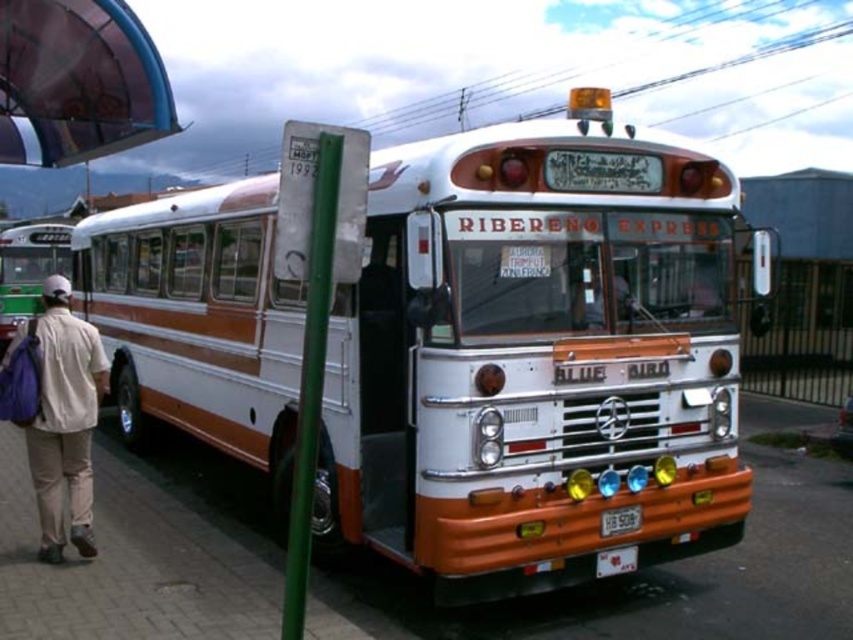
You are a delivery person trying to attach a package to the bus. The package requires a surface that can hold heavy items. Which object between the green metallic pole at center and the white plastic license plate at center would be more suitable for attaching the package?

The green metallic pole at center is larger in size than the white plastic license plate at center, so it would provide a more stable and secure surface for attaching the heavy package.

You are standing at the bus stop and want to take a photo of the vintage bus. The camera you have can only focus on objects within 15 feet. Is the point at coordinate point (532, 376) on the bus within the camera focus range?

The point at coordinate point (532, 376) on the bus is 14.62 feet from the camera, which is within the 15 feet focus range. Therefore, the camera can focus on it.